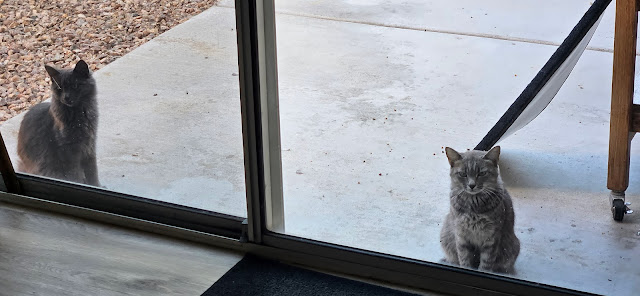
At what (x,y) coordinates should I click in order to perform the action: click on windows. Please return your answer as a coordinate pair (x, y). The height and width of the screenshot is (296, 640). Looking at the image, I should click on (168, 89), (393, 64).